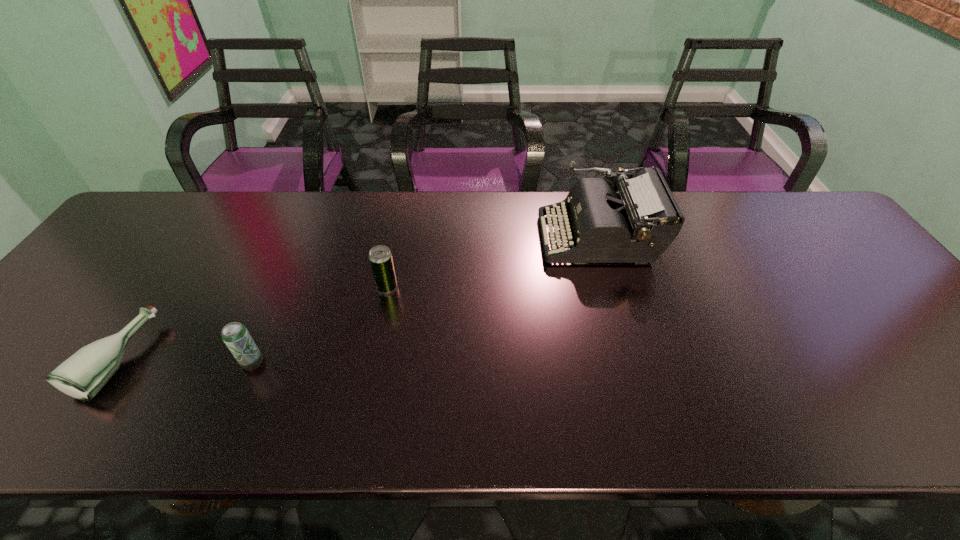
Where is `vacant point located 0.230m on the front-facing side of the typewriter`? vacant point located 0.230m on the front-facing side of the typewriter is located at coordinates (462, 237).

You are a GUI agent. You are given a task and a screenshot of the screen. Output one action in this format:
    pyautogui.click(x=<x>, y=<y>)
    Task: Click on the free space located 0.140m on the back of the third object from left to right
    The width and height of the screenshot is (960, 540).
    Given the screenshot: What is the action you would take?
    pyautogui.click(x=396, y=244)

Image resolution: width=960 pixels, height=540 pixels. I want to click on vacant space located on the right of the second object from left to right, so click(x=295, y=362).

At what (x,y) coordinates should I click in order to perform the action: click on vacant position located on the right of the leftmost object. Please return your answer as a coordinate pair (x, y). Looking at the image, I should click on (166, 359).

Identify the location of object positioned at the far edge. (636, 225).

You are a GUI agent. You are given a task and a screenshot of the screen. Output one action in this format:
    pyautogui.click(x=<x>, y=<y>)
    Task: Click on the object that is at the near edge
    This screenshot has width=960, height=540.
    Given the screenshot: What is the action you would take?
    pyautogui.click(x=81, y=376)

I want to click on blank area at the far edge, so click(x=426, y=199).

The width and height of the screenshot is (960, 540). Find the location of `vacant space at the near edge of the desktop`. vacant space at the near edge of the desktop is located at coordinates tap(775, 401).

You are a GUI agent. You are given a task and a screenshot of the screen. Output one action in this format:
    pyautogui.click(x=<x>, y=<y>)
    Task: Click on the vacant region at the left edge of the desktop
    The width and height of the screenshot is (960, 540).
    Given the screenshot: What is the action you would take?
    click(153, 266)

The image size is (960, 540). In the image, there is a desktop. What are the coordinates of `vacant space at the right edge` in the screenshot? It's located at (821, 243).